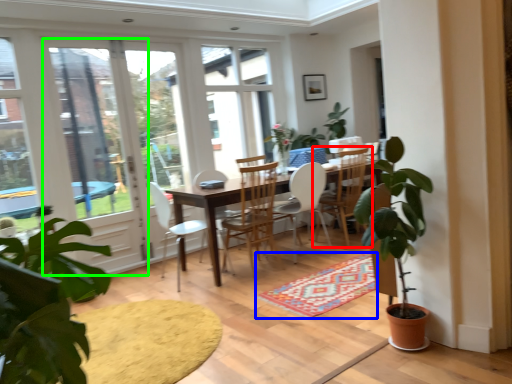
Question: Which object is positioned closest to chair (highlighted by a red box)? Select from carpets (highlighted by a blue box) and screen door (highlighted by a green box).

Choices:
 (A) carpets
 (B) screen door

Answer: (A)